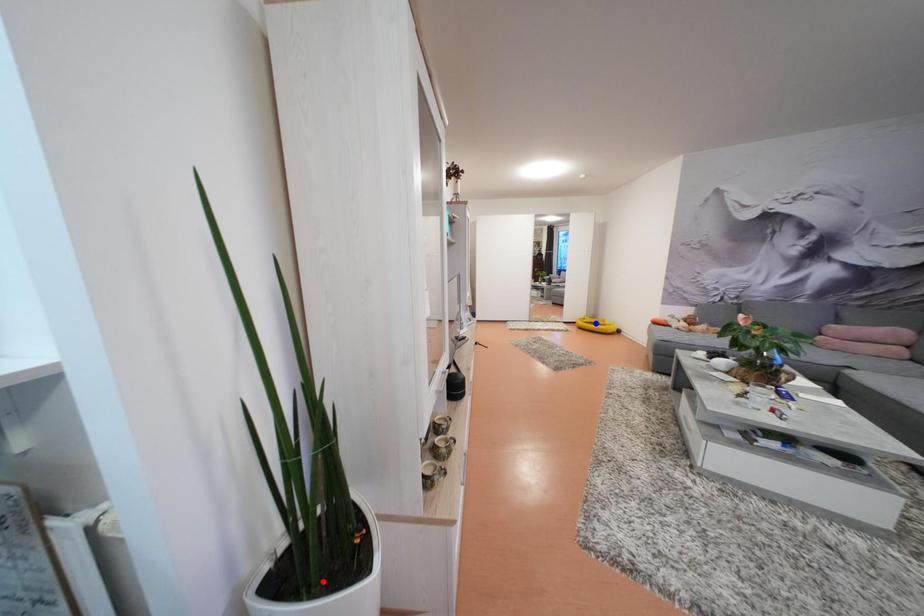
Question: Which of the two points in the image is closer to the camera?

Choices:
 (A) Blue point is closer.
 (B) Red point is closer.

Answer: (B)